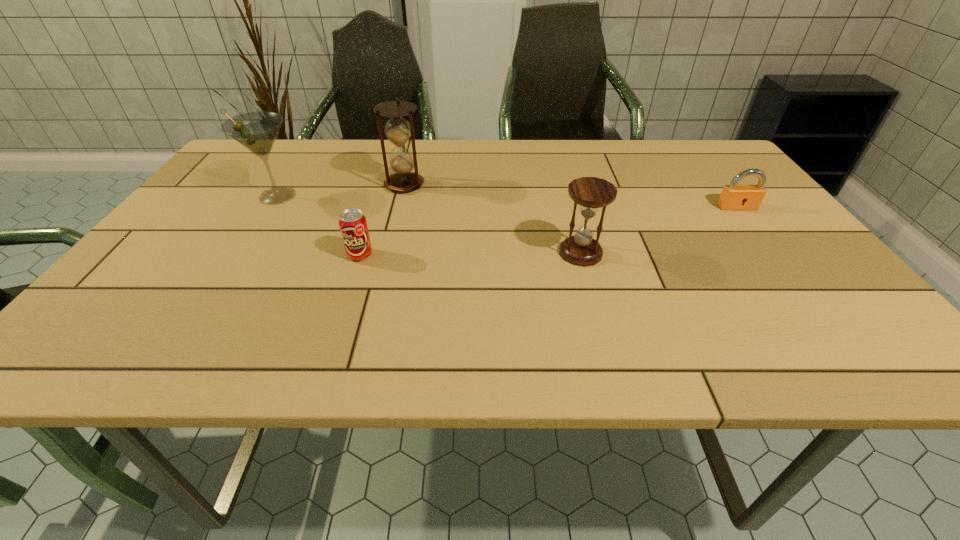
At what (x,y) coordinates should I click in order to perform the action: click on the leftmost object. Please return your answer as a coordinate pair (x, y). The width and height of the screenshot is (960, 540). Looking at the image, I should click on (257, 131).

This screenshot has height=540, width=960. In order to click on the farther hourglass in this screenshot , I will do `click(398, 130)`.

The height and width of the screenshot is (540, 960). In order to click on the taller hourglass in this screenshot , I will do `click(398, 130)`.

The image size is (960, 540). Find the location of `the right hourglass`. the right hourglass is located at coordinates (591, 193).

The width and height of the screenshot is (960, 540). Identify the location of the second object from right to left. (591, 193).

Image resolution: width=960 pixels, height=540 pixels. What are the coordinates of `padlock` in the screenshot? It's located at (733, 197).

Where is `soda`? soda is located at coordinates (353, 225).

At what (x,y) coordinates should I click in order to perform the action: click on free location located 0.240m on the back of the martini. Please return your answer as a coordinate pair (x, y). Looking at the image, I should click on (311, 143).

Locate an element on the screen. vacant space situated 0.240m on the left of the left hourglass is located at coordinates (296, 185).

This screenshot has height=540, width=960. Identify the location of vacant space situated on the right of the nearer hourglass. (716, 253).